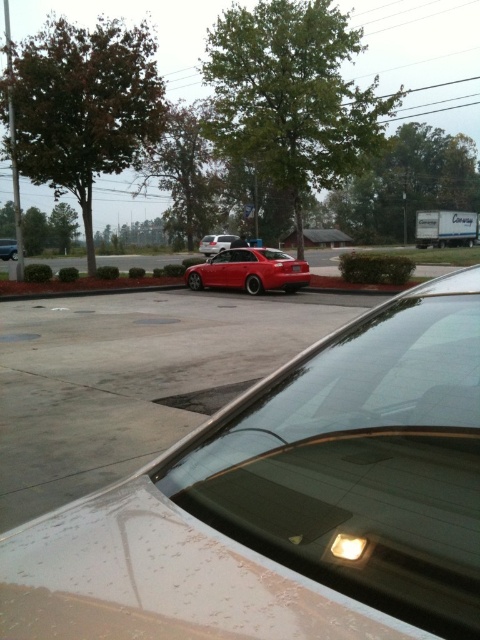
You are driving a car and want to park in the parking lot. You see the shiny red car at center and the smooth concrete curb at center. Which object is nearer to your current position?

The shiny red car at center is closer to the viewer than the smooth concrete curb at center, so the shiny red car at center is nearer to your current position.

You are driving a car and want to park next to the satin silver sedan at center. There is a smooth concrete curb at center in the way. Which direction should you move your car to avoid hitting the curb while aligning with the sedan?

You should move your car to the right to avoid the smooth concrete curb at center, as it is positioned to the left of the satin silver sedan at center. This will allow you to align with the sedan without hitting the curb.